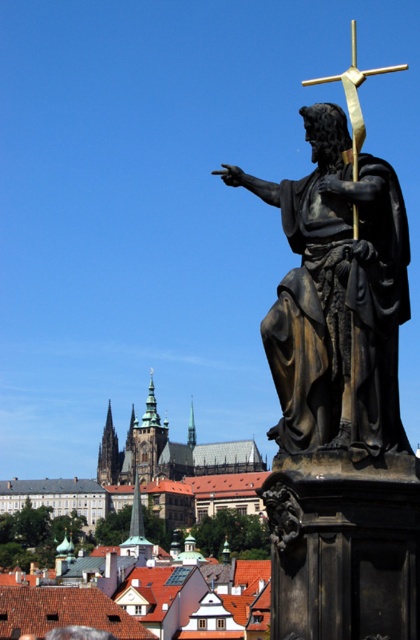
You are standing in front of the statue of the figure holding a golden cross. There is a point marked at coordinates [336,296]. What object is located at that point?

The bronze statue at right is located at point [336,296].

From the picture: You are standing in front of the statue and want to take a photo. There are two points marked in the image at coordinates point (396, 232) and point (351, 109). Which point should you focus on to ensure it appears clearer in your photo?

You should focus on point (396, 232) because it is closer to the camera and will appear clearer in the photo.